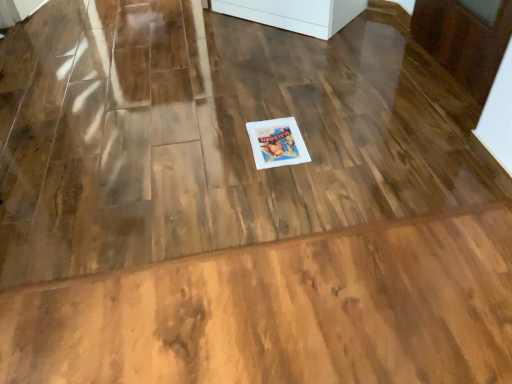
I want to click on vacant region to the left of white glossy comic book at center, so [216, 145].